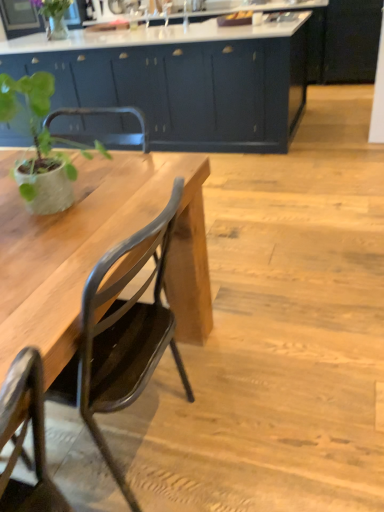
Question: Considering their positions, is green matte plant at left located in front of or behind green matte vase at upper left?

Choices:
 (A) front
 (B) behind

Answer: (A)

Question: From the image's perspective, relative to green matte vase at upper left, is green matte plant at left above or below?

Choices:
 (A) below
 (B) above

Answer: (A)

Question: Which object is positioned farthest from the green matte vase at upper left?

Choices:
 (A) matte dark blue cabinets at center
 (B) matte black chair at left
 (C) green matte plant at left

Answer: (B)

Question: Estimate the real-world distances between objects in this image. Which object is farther from the matte black chair at left?

Choices:
 (A) matte dark blue cabinets at center
 (B) green matte plant at left
 (C) green matte vase at upper left

Answer: (C)